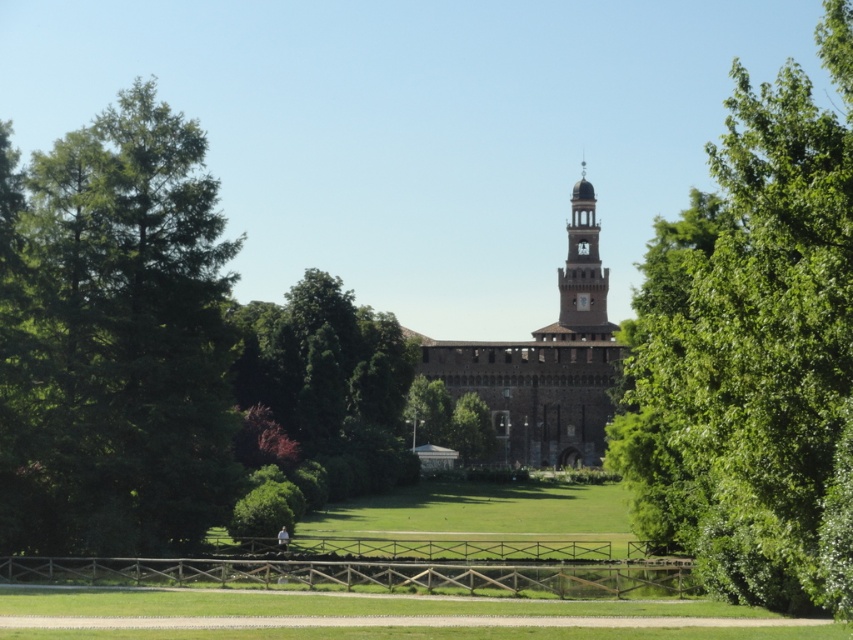
Question: Which is farther from the green leafy tree at center?

Choices:
 (A) green leafy tree at left
 (B) smooth stone bell tower at center

Answer: (B)

Question: Which point is farther from the camera taking this photo?

Choices:
 (A) (601, 285)
 (B) (657, 490)

Answer: (A)

Question: In this image, where is brown stone tower at center located relative to smooth stone bell tower at center?

Choices:
 (A) above
 (B) below

Answer: (B)

Question: Can you confirm if green leafy tree at center is smaller than smooth stone bell tower at center?

Choices:
 (A) yes
 (B) no

Answer: (B)

Question: Is green leafy tree at center above smooth stone bell tower at center?

Choices:
 (A) no
 (B) yes

Answer: (B)

Question: Among these points, which one is nearest to the camera?

Choices:
 (A) (502, 449)
 (B) (805, 547)
 (C) (96, 246)
 (D) (601, 324)

Answer: (B)